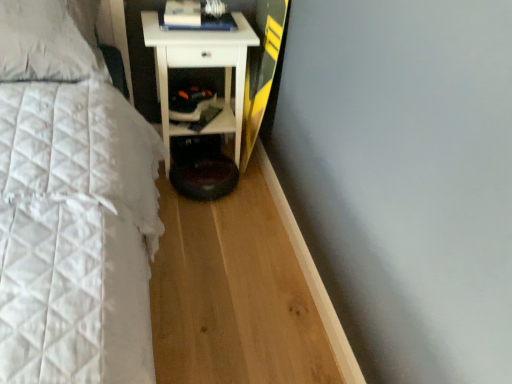
Locate an element on the screen. This screenshot has width=512, height=384. vacant area in front of white glossy nightstand at center is located at coordinates (214, 216).